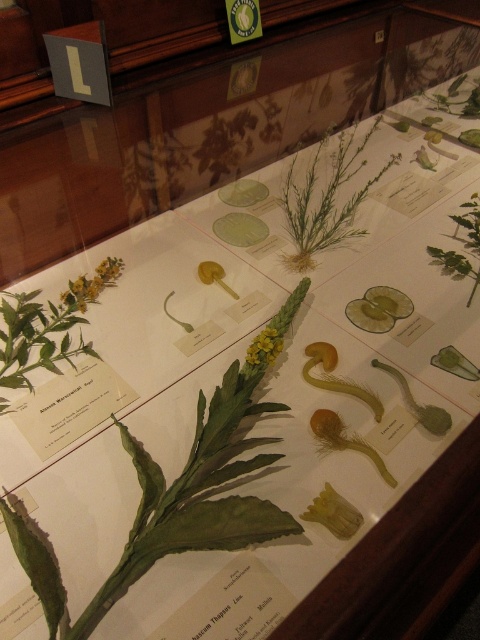
You are a botany student examining the display case. You need to reach both the green matte leaf at center and the yellow matte flower at upper left to take notes. Which specimen will you need to reach further back in the display case to access?

The yellow matte flower at upper left is further away from you than the green matte leaf at center, so you will need to reach further back to access the yellow matte flower at upper left.

Based on the photo, you are a botany student examining the display case. You notice the green matte plant at center and the yellow matte flower at center. Which one is positioned higher in the display case?

The green matte plant at center is positioned higher than the yellow matte flower at center in the display case.